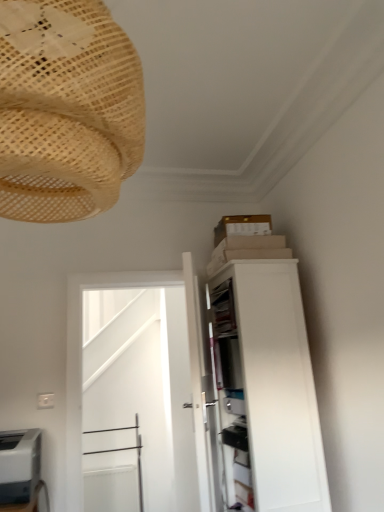
This screenshot has height=512, width=384. What do you see at coordinates (263, 391) in the screenshot? I see `white matte cabinet at upper right` at bounding box center [263, 391].

You are a GUI agent. You are given a task and a screenshot of the screen. Output one action in this format:
    pyautogui.click(x=<x>, y=<y>)
    Task: Click on the gray matte printer at lower left
    
    Given the screenshot: What is the action you would take?
    pyautogui.click(x=19, y=465)

Measure the distance between point (163, 476) and camera.

The depth of point (163, 476) is 3.50 meters.

At what (x,y) coordinates should I click in order to perform the action: click on natural woven lampshade at upper left. Please return your answer as a coordinate pair (x, y). Looking at the image, I should click on (66, 110).

Is natural woven lampshade at upper left at the back of gray matte printer at lower left?

No, gray matte printer at lower left's orientation is not away from natural woven lampshade at upper left.

Which point is more distant from viewer, (3, 458) or (83, 166)?

The point (3, 458) is farther.

Between gray matte printer at lower left and natural woven lampshade at upper left, which one has larger width?

Wider between the two is natural woven lampshade at upper left.

Can you confirm if gray matte printer at lower left is shorter than natural woven lampshade at upper left?

Yes, gray matte printer at lower left is shorter than natural woven lampshade at upper left.

Is natural woven lampshade at upper left behind white glossy door at center?

No, it is in front of white glossy door at center.

Looking at this image, from the image's perspective, which one is positioned lower, natural woven lampshade at upper left or white glossy door at center?

white glossy door at center.

In terms of height, does natural woven lampshade at upper left look taller or shorter compared to white glossy door at center?

Considering their sizes, natural woven lampshade at upper left has less height than white glossy door at center.

From a real-world perspective, which object rests below the other?

In real-world perspective, white glossy door at center is lower.

Considering the relative sizes of white glossy door at center and white matte cabinet at upper right in the image provided, is white glossy door at center smaller than white matte cabinet at upper right?

Yes, white glossy door at center is smaller than white matte cabinet at upper right.

Between white glossy door at center and white matte cabinet at upper right, which one has larger width?

With larger width is white matte cabinet at upper right.

Image resolution: width=384 pixels, height=512 pixels. Identify the location of cabinetry above the white glossy door at center (from the image's perspective). (263, 391).

From the image's perspective, is white glossy door at center above or below white matte cabinet at upper right?

Based on their image positions, white glossy door at center is located beneath white matte cabinet at upper right.

From a real-world perspective, is natural woven lampshade at upper left under white matte cabinet at upper right?

No, from a real-world perspective, natural woven lampshade at upper left is not beneath white matte cabinet at upper right.

From the image's perspective, would you say natural woven lampshade at upper left is shown under white matte cabinet at upper right?

Incorrect, from the image's perspective, natural woven lampshade at upper left is higher than white matte cabinet at upper right.

Where is `cabinetry that appears behind the natural woven lampshade at upper left`? cabinetry that appears behind the natural woven lampshade at upper left is located at coordinates (263, 391).

Locate an element on the screen. Image resolution: width=384 pixels, height=512 pixels. door on the right of the gray matte printer at lower left is located at coordinates (138, 396).

From a real-world perspective, does white glossy door at center stand above gray matte printer at lower left?

Correct, in the physical world, white glossy door at center is higher than gray matte printer at lower left.

Does white glossy door at center appear on the left side of gray matte printer at lower left?

Incorrect, white glossy door at center is not on the left side of gray matte printer at lower left.

Can we say white glossy door at center lies outside gray matte printer at lower left?

That's correct, white glossy door at center is outside of gray matte printer at lower left.

Looking at this image, is natural woven lampshade at upper left shorter than gray matte printer at lower left?

In fact, natural woven lampshade at upper left may be taller than gray matte printer at lower left.

Looking at this image, can you confirm if natural woven lampshade at upper left is bigger than gray matte printer at lower left?

Indeed, natural woven lampshade at upper left has a larger size compared to gray matte printer at lower left.

Locate an element on the screen. This screenshot has width=384, height=512. appliance below the natural woven lampshade at upper left (from the image's perspective) is located at coordinates (19, 465).

How different are the orientations of natural woven lampshade at upper left and gray matte printer at lower left in degrees?

178 degrees.

At what (x,y) coordinates should I click in order to perform the action: click on appliance on the left of white matte cabinet at upper right. Please return your answer as a coordinate pair (x, y). Image resolution: width=384 pixels, height=512 pixels. Looking at the image, I should click on [x=19, y=465].

Between point (283, 269) and point (3, 471), which one is positioned in front?

The point (3, 471) is in front.

Considering the sizes of objects white matte cabinet at upper right and gray matte printer at lower left in the image provided, who is bigger, white matte cabinet at upper right or gray matte printer at lower left?

white matte cabinet at upper right.

Is white matte cabinet at upper right aimed at gray matte printer at lower left?

Yes, white matte cabinet at upper right is aimed at gray matte printer at lower left.

The height and width of the screenshot is (512, 384). I want to click on appliance on the left side of natural woven lampshade at upper left, so click(x=19, y=465).

Locate an element on the screen. door that appears on the right of natural woven lampshade at upper left is located at coordinates (138, 396).

From the image, which object appears to be nearer to natural woven lampshade at upper left, gray matte printer at lower left or white glossy door at center?

gray matte printer at lower left is positioned closer to the anchor natural woven lampshade at upper left.

Which object lies nearer to the anchor point natural woven lampshade at upper left, white matte cabinet at upper right or white glossy door at center?

white matte cabinet at upper right.

Considering their positions, is natural woven lampshade at upper left positioned further to white matte cabinet at upper right than white glossy door at center?

white glossy door at center is further to white matte cabinet at upper right.

When comparing their distances from gray matte printer at lower left, does natural woven lampshade at upper left or white matte cabinet at upper right seem further?

Among the two, natural woven lampshade at upper left is located further to gray matte printer at lower left.

Considering their positions, is natural woven lampshade at upper left positioned further to gray matte printer at lower left than white glossy door at center?

Among the two, white glossy door at center is located further to gray matte printer at lower left.

Which object lies nearer to the anchor point natural woven lampshade at upper left, gray matte printer at lower left or white matte cabinet at upper right?

white matte cabinet at upper right lies closer to natural woven lampshade at upper left than the other object.

Based on the photo, from the image, which object appears to be farther from white glossy door at center, natural woven lampshade at upper left or white matte cabinet at upper right?

natural woven lampshade at upper left lies further to white glossy door at center than the other object.

When comparing their distances from white glossy door at center, does white matte cabinet at upper right or natural woven lampshade at upper left seem further?

natural woven lampshade at upper left is positioned further to the anchor white glossy door at center.

This screenshot has width=384, height=512. I want to click on door between gray matte printer at lower left and white matte cabinet at upper right from left to right, so click(x=138, y=396).

I want to click on cabinetry between natural woven lampshade at upper left and white glossy door at center in the vertical direction, so click(263, 391).

Find the location of a particular element. This screenshot has width=384, height=512. cabinetry between natural woven lampshade at upper left and gray matte printer at lower left in the vertical direction is located at coordinates (263, 391).

Identify the location of door between natural woven lampshade at upper left and gray matte printer at lower left vertically. (138, 396).